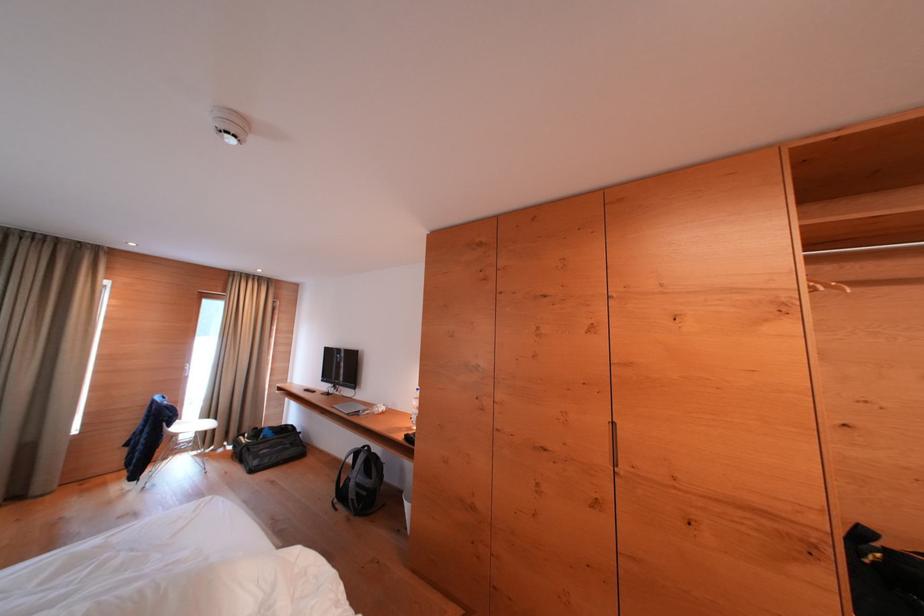
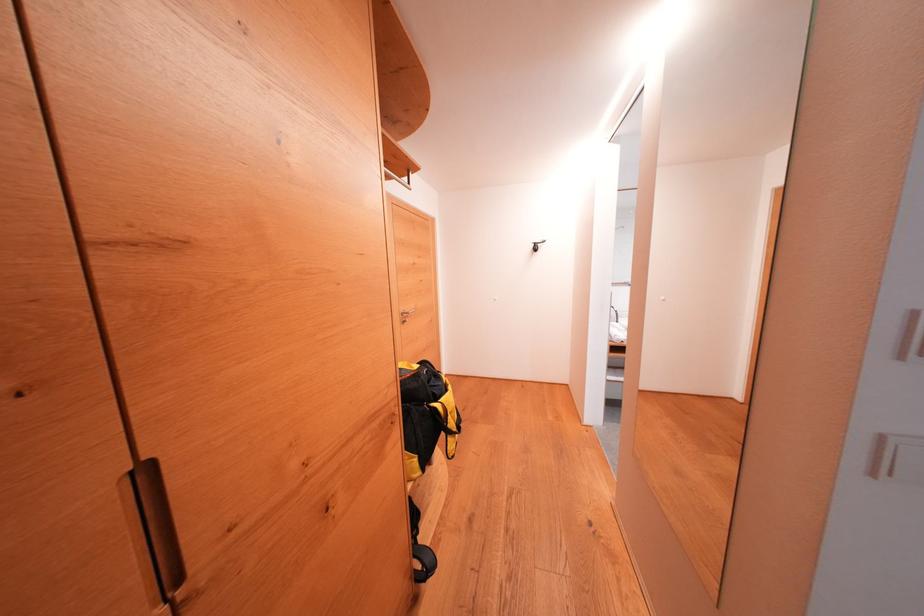
Question: The first image is from the beginning of the video and the second image is from the end. How did the camera likely rotate when shooting the video?

Choices:
 (A) Left
 (B) Right
 (C) Up
 (D) Down

Answer: (B)